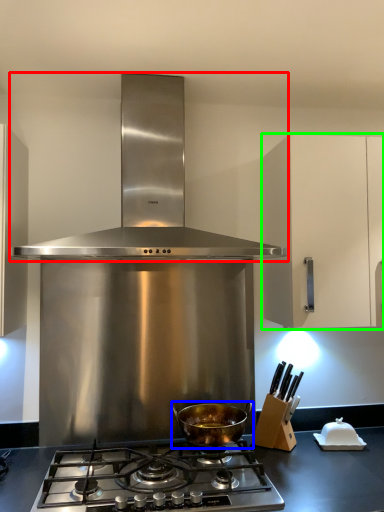
Question: Which object is the closest to the kitchen appliance (highlighted by a red box)? Choose among these: kitchen appliance (highlighted by a blue box) or cabinetry (highlighted by a green box).

Choices:
 (A) kitchen appliance
 (B) cabinetry

Answer: (B)